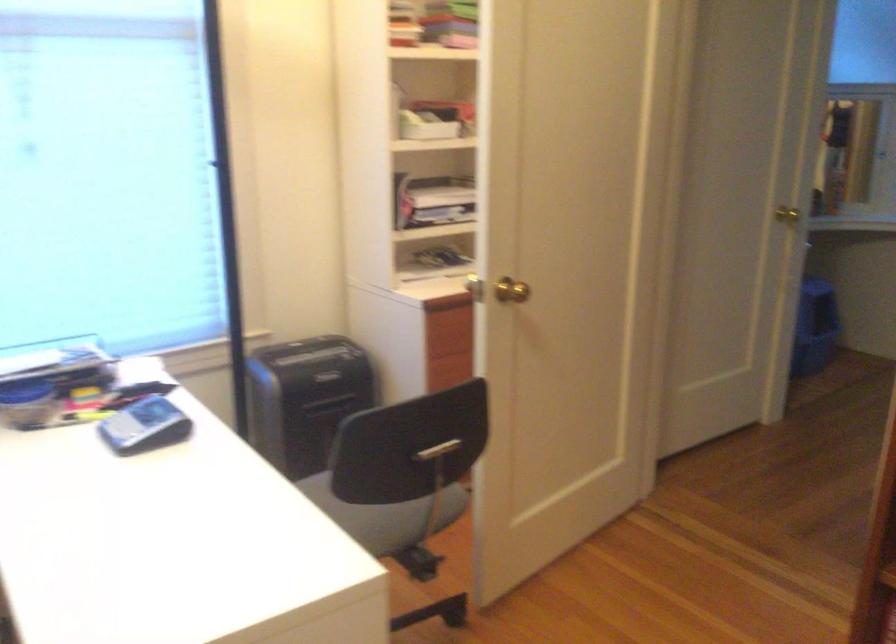
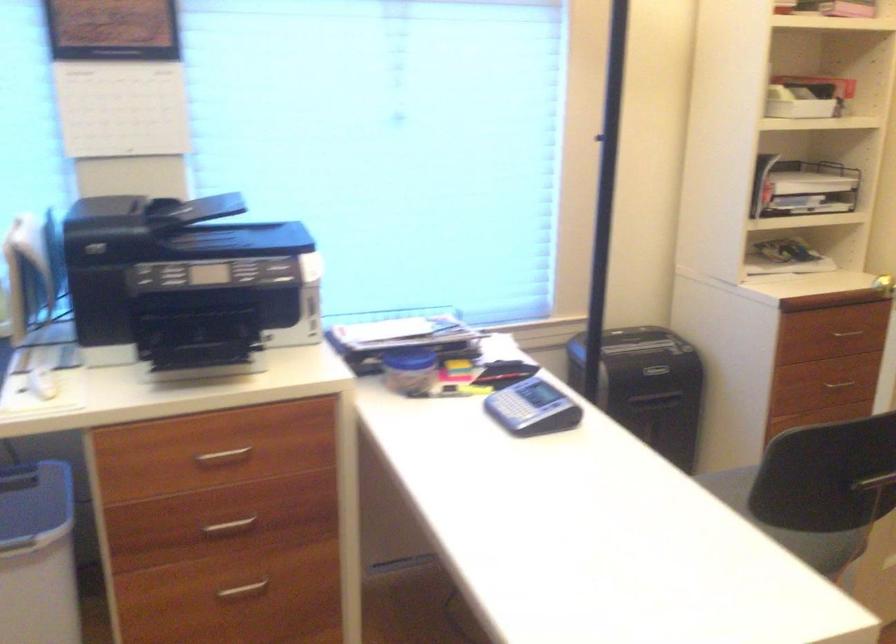
The point at (402, 503) is marked in the first image. Where is the corresponding point in the second image?

(788, 525)